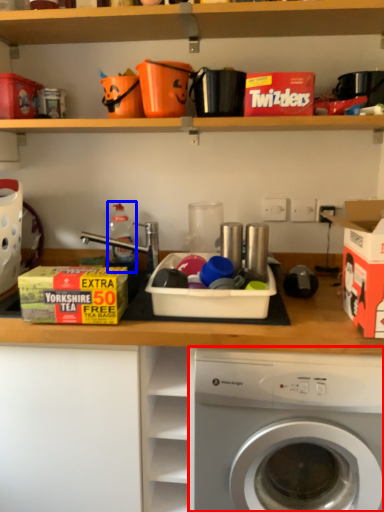
Question: Which object appears closest to the camera in this image, washing machine (highlighted by a red box) or bottle (highlighted by a blue box)?

Choices:
 (A) washing machine
 (B) bottle

Answer: (A)